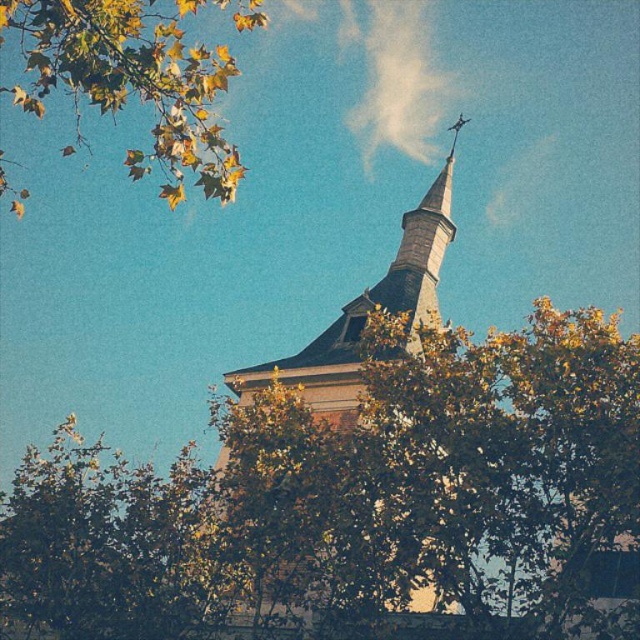
Does yellow-green leaves at upper left have a lesser width compared to smooth gray steeple at center?

In fact, yellow-green leaves at upper left might be wider than smooth gray steeple at center.

Is yellow-green leaves at upper left closer to camera compared to smooth gray steeple at center?

Yes, yellow-green leaves at upper left is closer to the viewer.

Which is in front, point (189, 156) or point (333, 353)?

Point (189, 156)

Where is `yellow-green leaves at upper left`? yellow-green leaves at upper left is located at coordinates (136, 77).

Describe the element at coordinates (353, 499) in the screenshot. The image size is (640, 640). I see `green leafy tree at center` at that location.

Is green leafy tree at center thinner than yellow-green leaves at upper left?

Incorrect, green leafy tree at center's width is not less than yellow-green leaves at upper left's.

Is point (593, 336) closer to viewer compared to point (216, 134)?

That is False.

Image resolution: width=640 pixels, height=640 pixels. I want to click on green leafy tree at center, so click(x=353, y=499).

Is green leafy tree at center below smooth gray steeple at center?

Yes.

Can you confirm if green leafy tree at center is taller than smooth gray steeple at center?

No.

Between point (330, 545) and point (449, 152), which one is positioned in front?

Point (330, 545) is in front.

This screenshot has height=640, width=640. In order to click on green leafy tree at center in this screenshot , I will do `click(353, 499)`.